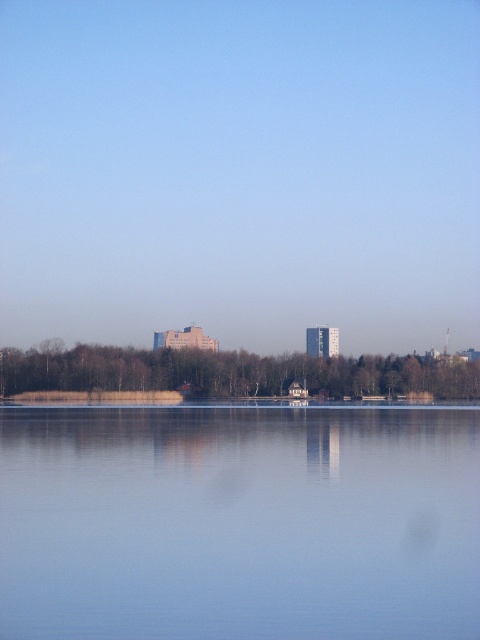
Question: Is smooth concrete buildings at center wider than transparent glass water at center?

Choices:
 (A) no
 (B) yes

Answer: (B)

Question: Can you confirm if smooth concrete buildings at center is positioned to the left of transparent glass water at center?

Choices:
 (A) yes
 (B) no

Answer: (A)

Question: Where is smooth concrete buildings at center located in relation to transparent glass water at center in the image?

Choices:
 (A) below
 (B) above

Answer: (B)

Question: Which of the following is the closest to the observer?

Choices:
 (A) smooth concrete buildings at center
 (B) transparent glass water at center

Answer: (B)

Question: Which point appears closest to the camera in this image?

Choices:
 (A) (325, 51)
 (B) (252, 576)

Answer: (B)